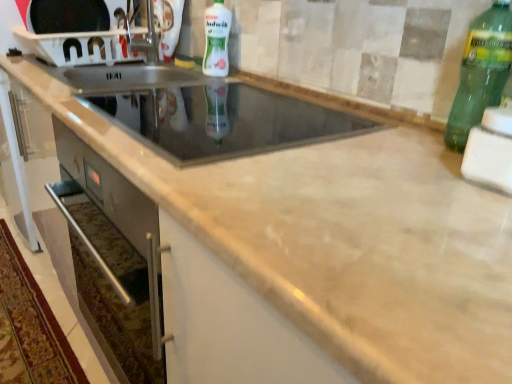
Question: Considering the relative sizes of white plastic microwave at upper left, arranged as the third appliance when ordered from the bottom, and green glass bottle at right, the 2th bottle in the top-to-bottom sequence, in the image provided, is white plastic microwave at upper left, arranged as the third appliance when ordered from the bottom, bigger than green glass bottle at right, the 2th bottle in the top-to-bottom sequence,?

Choices:
 (A) no
 (B) yes

Answer: (B)

Question: From a real-world perspective, is white plastic microwave at upper left, the third appliance viewed from the front, beneath green glass bottle at right, which is counted as the second bottle, starting from the back?

Choices:
 (A) no
 (B) yes

Answer: (B)

Question: Is there a large distance between white plastic microwave at upper left, which ranks as the third appliance in right-to-left order, and green glass bottle at right, which appears as the second bottle when viewed from the left?

Choices:
 (A) no
 (B) yes

Answer: (B)

Question: Does white plastic microwave at upper left, arranged as the first appliance when viewed from the left, lie behind green glass bottle at right, the 2th bottle in the top-to-bottom sequence?

Choices:
 (A) no
 (B) yes

Answer: (B)

Question: Can we say white plastic microwave at upper left, placed as the first appliance when sorted from top to bottom, lies outside green glass bottle at right, placed as the first bottle when sorted from right to left?

Choices:
 (A) no
 (B) yes

Answer: (B)

Question: Is white plastic microwave at upper left, arranged as the first appliance when viewed from the left, facing towards green glass bottle at right, placed as the first bottle when sorted from front to back?

Choices:
 (A) no
 (B) yes

Answer: (B)

Question: Can you confirm if white plastic microwave at upper left, the third appliance viewed from the front, is shorter than white glossy bottle at upper center, acting as the 1th bottle starting from the back?

Choices:
 (A) no
 (B) yes

Answer: (B)

Question: Can you confirm if white plastic microwave at upper left, which ranks as the third appliance in right-to-left order, is bigger than white glossy bottle at upper center, the first bottle viewed from the left?

Choices:
 (A) yes
 (B) no

Answer: (A)

Question: Is white plastic microwave at upper left, which ranks as the third appliance in right-to-left order, not within white glossy bottle at upper center, arranged as the 2th bottle when viewed from the front?

Choices:
 (A) no
 (B) yes

Answer: (B)

Question: Is white plastic microwave at upper left, which ranks as the third appliance in right-to-left order, behind white glossy bottle at upper center, the first bottle viewed from the left?

Choices:
 (A) no
 (B) yes

Answer: (B)

Question: From a real-world perspective, is white plastic microwave at upper left, arranged as the third appliance when ordered from the bottom, under white glossy bottle at upper center, which appears as the 2th bottle when ordered from the bottom?

Choices:
 (A) yes
 (B) no

Answer: (A)

Question: Could you tell me if white plastic microwave at upper left, which ranks as the third appliance in right-to-left order, is facing white glossy bottle at upper center, the first bottle viewed from the left?

Choices:
 (A) yes
 (B) no

Answer: (B)

Question: Is white foam sponge at right, the third appliance from the left, far from white plastic microwave at upper left, marked as the 1th appliance in a back-to-front arrangement?

Choices:
 (A) yes
 (B) no

Answer: (A)